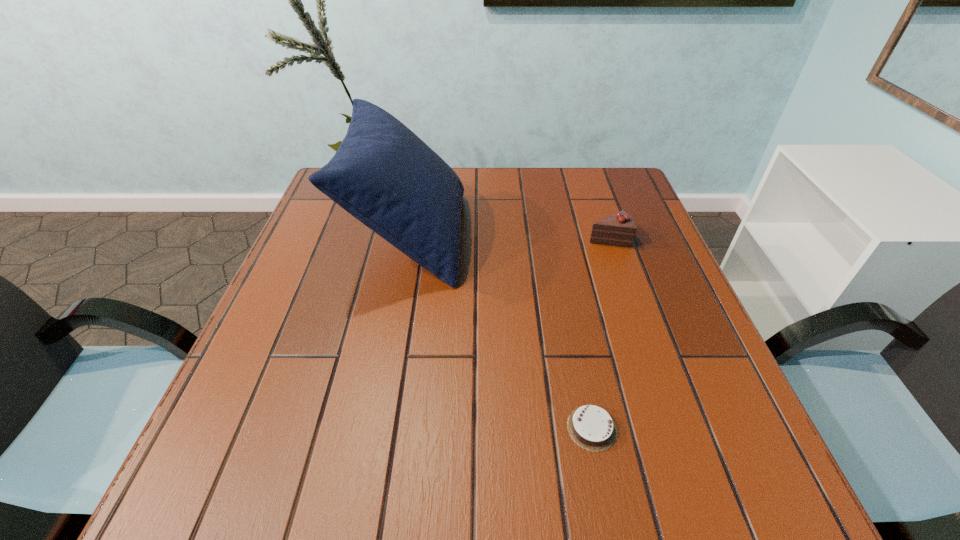
Image resolution: width=960 pixels, height=540 pixels. What are the coordinates of `cushion` in the screenshot? It's located at click(x=383, y=174).

You are a GUI agent. You are given a task and a screenshot of the screen. Output one action in this format:
    pyautogui.click(x=<x>, y=<y>)
    Task: Click on the leftmost object
    This screenshot has width=960, height=540.
    Given the screenshot: What is the action you would take?
    pyautogui.click(x=383, y=174)

Locate an element on the screen. Image resolution: width=960 pixels, height=540 pixels. the second tallest object is located at coordinates (619, 229).

The height and width of the screenshot is (540, 960). Identify the location of the taller chocolate cake. (619, 229).

This screenshot has width=960, height=540. What are the coordinates of `the nearer chocolate cake` in the screenshot? It's located at (591, 427).

Locate an element on the screen. This screenshot has width=960, height=540. the second object from right to left is located at coordinates [x=591, y=427].

Where is `vacant space located on the facing side of the tallest object`? This screenshot has width=960, height=540. vacant space located on the facing side of the tallest object is located at coordinates (515, 236).

The width and height of the screenshot is (960, 540). Find the location of `vacant space located on the front of the rightmost object`. vacant space located on the front of the rightmost object is located at coordinates (621, 276).

This screenshot has height=540, width=960. In order to click on vacant space located on the back of the nearest object in this screenshot , I will do `click(577, 354)`.

I want to click on object positioned at the far edge, so click(383, 174).